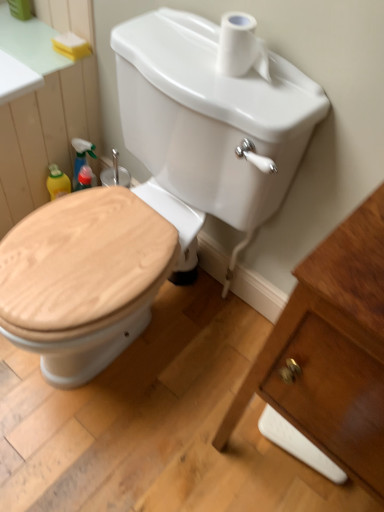
Find the location of a particular element. empty space that is in between wooden toilet seat at center and white glossy porcelain at right is located at coordinates (198, 413).